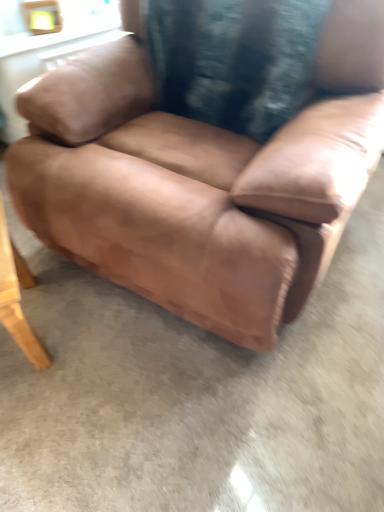
Where is `vacant area situated below wooden table at lower left (from a real-world perspective)`? vacant area situated below wooden table at lower left (from a real-world perspective) is located at coordinates (36, 321).